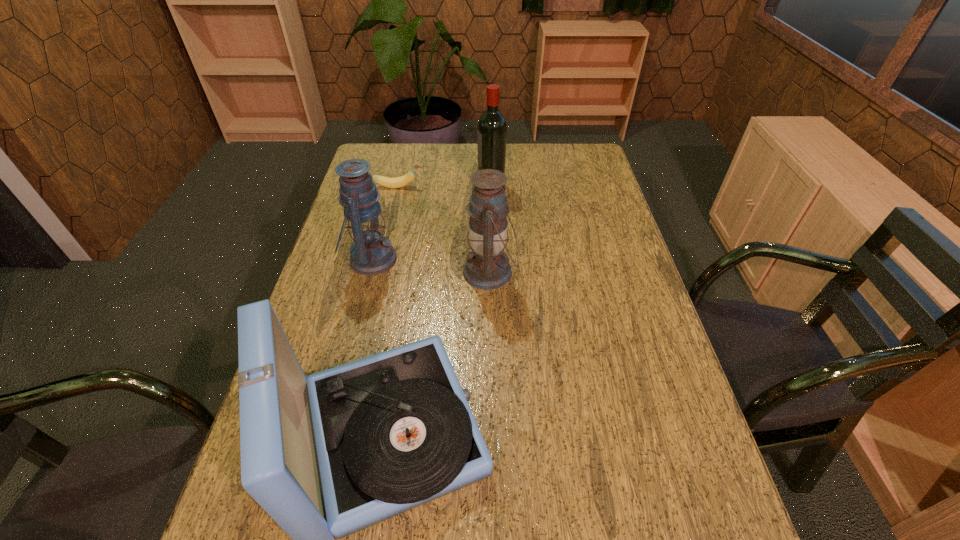
You are a GUI agent. You are given a task and a screenshot of the screen. Output one action in this format:
    pyautogui.click(x=<x>, y=<y>)
    Task: Click on the wine bottle
    
    Given the screenshot: What is the action you would take?
    pyautogui.click(x=492, y=129)

At what (x,y) coordinates should I click in order to perform the action: click on oil lamp. Please return your answer as a coordinate pair (x, y). This screenshot has height=540, width=960. Looking at the image, I should click on (487, 267).

The height and width of the screenshot is (540, 960). What are the coordinates of `lantern` in the screenshot? It's located at (371, 253).

Find the location of a particular element. The width and height of the screenshot is (960, 540). the shortest object is located at coordinates (402, 181).

Find the location of `vacant space located on the label of the wine bottle`. vacant space located on the label of the wine bottle is located at coordinates (369, 186).

Where is `free spot located on the label of the wine bottle`? This screenshot has height=540, width=960. free spot located on the label of the wine bottle is located at coordinates (406, 186).

You are a GUI agent. You are given a task and a screenshot of the screen. Output one action in this format:
    pyautogui.click(x=<x>, y=<y>)
    Task: Click on the blank area located 0.110m on the label of the wine bottle
    
    Given the screenshot: What is the action you would take?
    pyautogui.click(x=446, y=186)

This screenshot has height=540, width=960. Identify the location of free space located on the front of the oil lamp. (492, 320).

Where is `blank space located on the front-facing side of the lantern`? blank space located on the front-facing side of the lantern is located at coordinates (521, 259).

Locate an element on the screen. The width and height of the screenshot is (960, 540). vacant space located 0.160m at the stem of the banana is located at coordinates (468, 187).